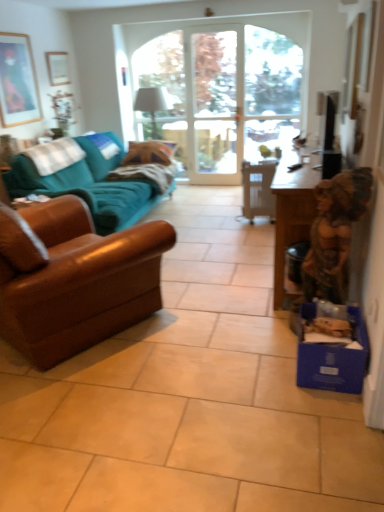
Describe the element at coordinates (55, 155) in the screenshot. I see `plush white pillow at left` at that location.

Image resolution: width=384 pixels, height=512 pixels. In order to click on plush white pillow at left in this screenshot , I will do 55,155.

This screenshot has height=512, width=384. I want to click on wooden table at right, so click(292, 211).

Where is `white plastic chair at center`? This screenshot has height=512, width=384. white plastic chair at center is located at coordinates (258, 190).

Find the location of a particular element. This screenshot has height=512, width=384. brown leather couch at left, the first studio couch in the front-to-back sequence is located at coordinates (75, 279).

Is blue cardboard box at lower right not within teal fabric couch at left, which ranks as the 2th studio couch in front-to-back order?

blue cardboard box at lower right lies outside teal fabric couch at left, which ranks as the 2th studio couch in front-to-back order,'s area.

Locate an element on the screen. The height and width of the screenshot is (512, 384). studio couch behind the blue cardboard box at lower right is located at coordinates (90, 178).

What's the angular difference between blue cardboard box at lower right and teal fabric couch at left, which is the 1th studio couch in back-to-front order,'s facing directions?

There is a 180-degree angle between the facing directions of blue cardboard box at lower right and teal fabric couch at left, which is the 1th studio couch in back-to-front order.

Consider the image. Is wooden table at right taller than blue cardboard box at lower right?

Yes, wooden table at right is taller than blue cardboard box at lower right.

From a real-world perspective, is wooden table at right physically above blue cardboard box at lower right?

Yes.

Is point (309, 208) closer or farther from the camera than point (363, 326)?

Clearly, point (309, 208) is more distant from the camera than point (363, 326).

Is wooden table at right in contact with blue cardboard box at lower right?

No.

From a real-world perspective, is white plastic chair at center physically located above or below teal fabric couch at left, which is the 1th studio couch in back-to-front order?

Clearly, from a real-world perspective, white plastic chair at center is below teal fabric couch at left, which is the 1th studio couch in back-to-front order.

Which is more to the left, white plastic chair at center or teal fabric couch at left, which ranks as the 2th studio couch in front-to-back order?

From the viewer's perspective, teal fabric couch at left, which ranks as the 2th studio couch in front-to-back order, appears more on the left side.

Who is bigger, white plastic chair at center or teal fabric couch at left, which is the 1th studio couch in back-to-front order?

Bigger between the two is teal fabric couch at left, which is the 1th studio couch in back-to-front order.

From the image's perspective, is white plastic chair at center positioned above or below teal fabric couch at left, which is the 1th studio couch in back-to-front order?

white plastic chair at center is below teal fabric couch at left, which is the 1th studio couch in back-to-front order.

Considering the relative sizes of wooden table at right and plush white pillow at left in the image provided, is wooden table at right shorter than plush white pillow at left?

No.

Which object is wider, wooden table at right or plush white pillow at left?

With larger width is wooden table at right.

I want to click on table on the right of plush white pillow at left, so click(292, 211).

Looking at their sizes, would you say blue cardboard box at lower right is wider or thinner than clear glass door at center?

blue cardboard box at lower right is wider than clear glass door at center.

Between blue cardboard box at lower right and clear glass door at center, which one is positioned behind?

clear glass door at center is behind.

Who is shorter, blue cardboard box at lower right or clear glass door at center?

Standing shorter between the two is blue cardboard box at lower right.

Can you tell me how much blue cardboard box at lower right and clear glass door at center differ in facing direction?

blue cardboard box at lower right and clear glass door at center are facing 90.9 degrees away from each other.

Is brown leather couch at left, the second studio couch viewed from the back, shorter than teal fabric couch at left, which ranks as the 2th studio couch in front-to-back order?

Incorrect, the height of brown leather couch at left, the second studio couch viewed from the back, does not fall short of that of teal fabric couch at left, which ranks as the 2th studio couch in front-to-back order.

Is brown leather couch at left, the first studio couch in the front-to-back sequence, located outside teal fabric couch at left, which ranks as the 2th studio couch in front-to-back order?

Yes, brown leather couch at left, the first studio couch in the front-to-back sequence, is not within teal fabric couch at left, which ranks as the 2th studio couch in front-to-back order.

Can you see brown leather couch at left, the first studio couch in the front-to-back sequence, touching teal fabric couch at left, which is the 1th studio couch in back-to-front order?

No, brown leather couch at left, the first studio couch in the front-to-back sequence, is not beside teal fabric couch at left, which is the 1th studio couch in back-to-front order.

Who is smaller, brown leather couch at left, the second studio couch viewed from the back, or teal fabric couch at left, which is the 1th studio couch in back-to-front order?

brown leather couch at left, the second studio couch viewed from the back.

From the image's perspective, is plush white pillow at left positioned above or below white plastic chair at center?

Based on their image positions, plush white pillow at left is located above white plastic chair at center.

Is plush white pillow at left aimed at white plastic chair at center?

No, plush white pillow at left is not facing towards white plastic chair at center.

In terms of height, does plush white pillow at left look taller or shorter compared to white plastic chair at center?

Considering their sizes, plush white pillow at left has less height than white plastic chair at center.

You are a GUI agent. You are given a task and a screenshot of the screen. Output one action in this format:
    pyautogui.click(x=<x>, y=<y>)
    Task: Click on the studio couch that is the 2nd object located above the blue cardboard box at lower right (from the image's perspective)
    
    Given the screenshot: What is the action you would take?
    pyautogui.click(x=90, y=178)

The width and height of the screenshot is (384, 512). Find the location of `cardboard box that appears below the wooden table at right (from a real-world perspective)`. cardboard box that appears below the wooden table at right (from a real-world perspective) is located at coordinates (332, 357).

Considering their positions, is plush white pillow at left positioned closer to blue cardboard box at lower right than teal fabric couch at left, which ranks as the 2th studio couch in front-to-back order?

teal fabric couch at left, which ranks as the 2th studio couch in front-to-back order.

When comparing their distances from blue cardboard box at lower right, does clear glass door at center or wooden table at right seem further?

clear glass door at center is further to blue cardboard box at lower right.

Consider the image. Which object lies further to the anchor point teal fabric couch at left, which is the 1th studio couch in back-to-front order, wooden table at right or plush white pillow at left?

Based on the image, wooden table at right appears to be further to teal fabric couch at left, which is the 1th studio couch in back-to-front order.

Looking at the image, which one is located further to blue cardboard box at lower right, clear glass door at center or teal fabric couch at left, which ranks as the 2th studio couch in front-to-back order?

clear glass door at center.

Based on their spatial positions, is clear glass door at center or plush white pillow at left closer to brown leather couch at left, the first studio couch in the front-to-back sequence?

Among the two, plush white pillow at left is located nearer to brown leather couch at left, the first studio couch in the front-to-back sequence.

Estimate the real-world distances between objects in this image. Which object is closer to clear glass door at center, white plastic chair at center or teal fabric couch at left, which is the 1th studio couch in back-to-front order?

white plastic chair at center is positioned closer to the anchor clear glass door at center.

When comparing their distances from clear glass door at center, does blue cardboard box at lower right or wooden table at right seem further?

blue cardboard box at lower right is positioned further to the anchor clear glass door at center.

From the image, which object appears to be farther from blue cardboard box at lower right, teal fabric couch at left, which ranks as the 2th studio couch in front-to-back order, or clear glass door at center?

clear glass door at center.

I want to click on cardboard box between brown leather couch at left, the first studio couch in the front-to-back sequence, and teal fabric couch at left, which is the 1th studio couch in back-to-front order, in the front-back direction, so click(332, 357).

I want to click on pillow located between blue cardboard box at lower right and white plastic chair at center in the depth direction, so click(55, 155).

The height and width of the screenshot is (512, 384). Find the location of `chair located between plush white pillow at left and wooden table at right in the left-right direction`. chair located between plush white pillow at left and wooden table at right in the left-right direction is located at coordinates (258, 190).

At what (x,y) coordinates should I click in order to perform the action: click on pillow between teal fabric couch at left, which is the 1th studio couch in back-to-front order, and clear glass door at center, along the z-axis. Please return your answer as a coordinate pair (x, y). Looking at the image, I should click on [x=55, y=155].